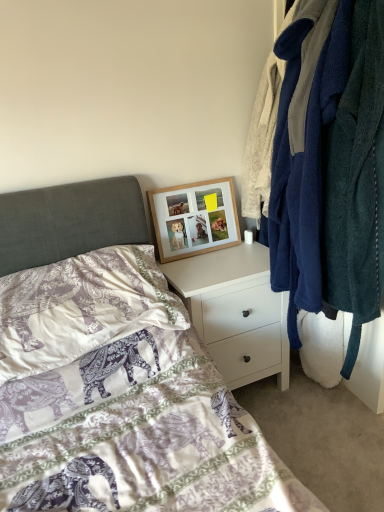
I want to click on soft fleece robes at right, so click(327, 159).

You are a GUI agent. You are given a task and a screenshot of the screen. Output one action in this format:
    pyautogui.click(x=<x>, y=<y>)
    Task: Click on the purple elephant-patterned pillow at lower left
    
    Given the screenshot: What is the action you would take?
    pyautogui.click(x=81, y=307)

This screenshot has height=512, width=384. Describe the element at coordinates (194, 218) in the screenshot. I see `woodenobject at upper center` at that location.

Locate an element on the screen. This screenshot has width=384, height=512. soft fleece robes at right is located at coordinates (327, 159).

From a real-world perspective, which object rests below the other?

From a 3D spatial view, woodenobject at upper center is below.

Considering the relative positions of woodenobject at upper center and soft fleece robes at right in the image provided, is woodenobject at upper center to the right of soft fleece robes at right from the viewer's perspective?

No, woodenobject at upper center is not to the right of soft fleece robes at right.

Does woodenobject at upper center have a larger size compared to soft fleece robes at right?

No, woodenobject at upper center is not bigger than soft fleece robes at right.

Find the location of a particular element. The width and height of the screenshot is (384, 512). pillow below the soft fleece robes at right (from a real-world perspective) is located at coordinates (81, 307).

From the image's perspective, is soft fleece robes at right located above purple elephant-patterned pillow at lower left?

Indeed, from the image's perspective, soft fleece robes at right is shown above purple elephant-patterned pillow at lower left.

Considering the sizes of soft fleece robes at right and purple elephant-patterned pillow at lower left in the image, is soft fleece robes at right wider or thinner than purple elephant-patterned pillow at lower left?

Clearly, soft fleece robes at right has less width compared to purple elephant-patterned pillow at lower left.

Which object is wider, soft fleece robes at right or white matte nightstand at upper center?

white matte nightstand at upper center.

Between soft fleece robes at right and white matte nightstand at upper center, which one is positioned in front?

soft fleece robes at right is closer to the camera.

Is soft fleece robes at right with white matte nightstand at upper center?

No, soft fleece robes at right is not next to white matte nightstand at upper center.

Between soft fleece robes at right and white matte nightstand at upper center, which one appears on the right side from the viewer's perspective?

From the viewer's perspective, soft fleece robes at right appears more on the right side.

How many degrees apart are the facing directions of woodenobject at upper center and purple elephant-patterned pillow at lower left?

woodenobject at upper center and purple elephant-patterned pillow at lower left are facing 1.46 degrees away from each other.

Which is behind, point (188, 187) or point (93, 297)?

The point (188, 187) is behind.

In the image, is woodenobject at upper center positioned in front of or behind purple elephant-patterned pillow at lower left?

woodenobject at upper center is positioned farther from the viewer than purple elephant-patterned pillow at lower left.

Is purple elephant-patterned pillow at lower left taller or shorter than white matte nightstand at upper center?

purple elephant-patterned pillow at lower left is shorter than white matte nightstand at upper center.

Between purple elephant-patterned pillow at lower left and white matte nightstand at upper center, which one has larger size?

white matte nightstand at upper center is bigger.

Is white matte nightstand at upper center completely or partially inside purple elephant-patterned pillow at lower left?

No, white matte nightstand at upper center is not inside purple elephant-patterned pillow at lower left.

Locate an element on the screen. pillow in front of the white matte nightstand at upper center is located at coordinates (81, 307).

From the image's perspective, is purple elephant-patterned pillow at lower left located above or below woodenobject at upper center?

Clearly, from the image's perspective, purple elephant-patterned pillow at lower left is below woodenobject at upper center.

Measure the distance from purple elephant-patterned pillow at lower left to woodenobject at upper center.

purple elephant-patterned pillow at lower left and woodenobject at upper center are 17.51 inches apart.

Can we say purple elephant-patterned pillow at lower left lies outside woodenobject at upper center?

Yes.

From a real-world perspective, is purple elephant-patterned pillow at lower left under woodenobject at upper center?

Yes.

Is soft fleece robes at right smaller than woodenobject at upper center?

No.

Can you confirm if soft fleece robes at right is thinner than woodenobject at upper center?

No.

How different are the orientations of soft fleece robes at right and woodenobject at upper center in degrees?

The facing directions of soft fleece robes at right and woodenobject at upper center are 94.1 degrees apart.

From a real-world perspective, is soft fleece robes at right positioned above or below woodenobject at upper center?

Clearly, from a real-world perspective, soft fleece robes at right is above woodenobject at upper center.

You are a GUI agent. You are given a task and a screenshot of the screen. Output one action in this format:
    pyautogui.click(x=<x>, y=<y>)
    Task: Click on the picture frame behind the soft fleece robes at right
    Image resolution: width=384 pixels, height=512 pixels.
    Given the screenshot: What is the action you would take?
    pyautogui.click(x=194, y=218)

Image resolution: width=384 pixels, height=512 pixels. What are the coordinates of `closet above the purple elephant-patterned pillow at lower left (from the image's perspective)` in the screenshot? It's located at (327, 159).

Considering their positions, is purple elephant-patterned pillow at lower left positioned further to woodenobject at upper center than white matte nightstand at upper center?

Based on the image, purple elephant-patterned pillow at lower left appears to be further to woodenobject at upper center.

Which object lies nearer to the anchor point white matte nightstand at upper center, purple elephant-patterned pillow at lower left or woodenobject at upper center?

woodenobject at upper center is closer to white matte nightstand at upper center.

Estimate the real-world distances between objects in this image. Which object is closer to white matte nightstand at upper center, woodenobject at upper center or soft fleece robes at right?

The object closer to white matte nightstand at upper center is woodenobject at upper center.

Based on their spatial positions, is soft fleece robes at right or purple elephant-patterned pillow at lower left closer to woodenobject at upper center?

Among the two, soft fleece robes at right is located nearer to woodenobject at upper center.

Considering their positions, is soft fleece robes at right positioned further to purple elephant-patterned pillow at lower left than white matte nightstand at upper center?

soft fleece robes at right.

Looking at the image, which one is located further to purple elephant-patterned pillow at lower left, woodenobject at upper center or soft fleece robes at right?

soft fleece robes at right is positioned further to the anchor purple elephant-patterned pillow at lower left.

Based on their spatial positions, is woodenobject at upper center or white matte nightstand at upper center further from soft fleece robes at right?

Based on the image, woodenobject at upper center appears to be further to soft fleece robes at right.

Considering their positions, is purple elephant-patterned pillow at lower left positioned further to soft fleece robes at right than woodenobject at upper center?

purple elephant-patterned pillow at lower left.

This screenshot has width=384, height=512. I want to click on nightstand located between soft fleece robes at right and woodenobject at upper center in the depth direction, so click(x=236, y=311).

Identify the location of nightstand between purple elephant-patterned pillow at lower left and soft fleece robes at right. (236, 311).

This screenshot has height=512, width=384. Find the location of `nightstand between purple elephant-patterned pillow at lower left and woodenobject at upper center from front to back`. nightstand between purple elephant-patterned pillow at lower left and woodenobject at upper center from front to back is located at coordinates (236, 311).

In order to click on picture frame between purple elephant-patterned pillow at lower left and soft fleece robes at right from left to right in this screenshot , I will do `click(194, 218)`.